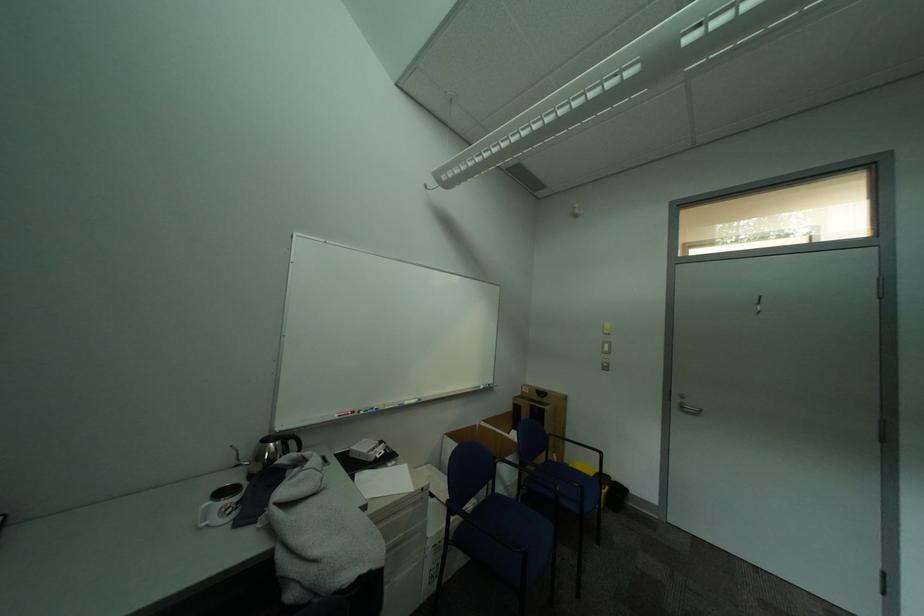
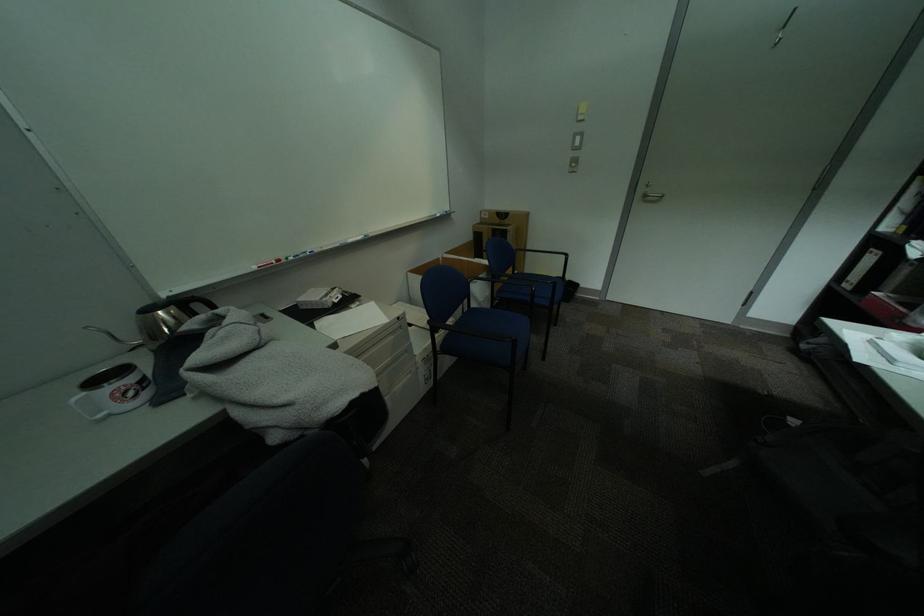
Question: I am providing you with two images of the same scene from different viewpoints. Which of the following objects are not visible in image2?

Choices:
 (A) white light switch
 (B) brown cardboard box
 (C) kettle handle
 (D) none of these

Answer: (D)